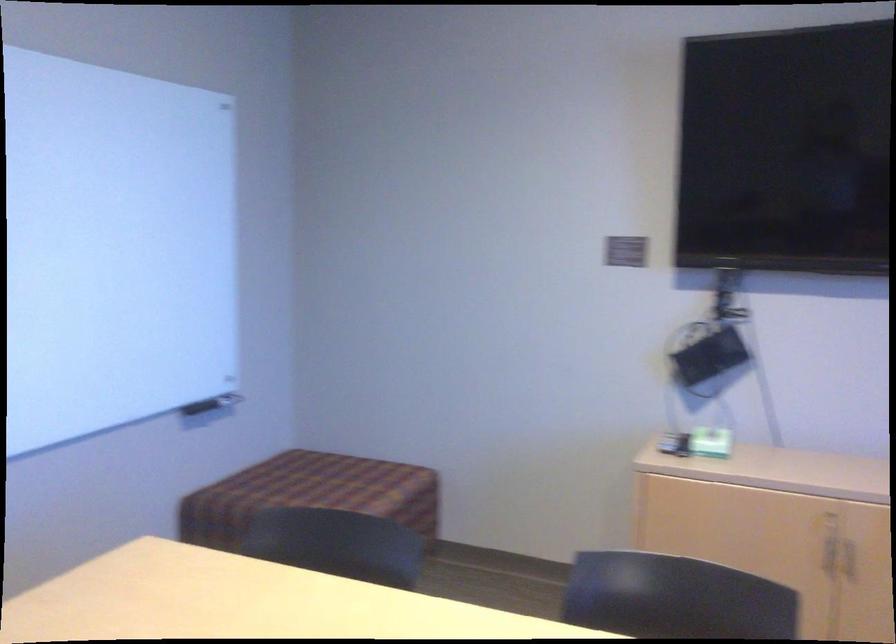
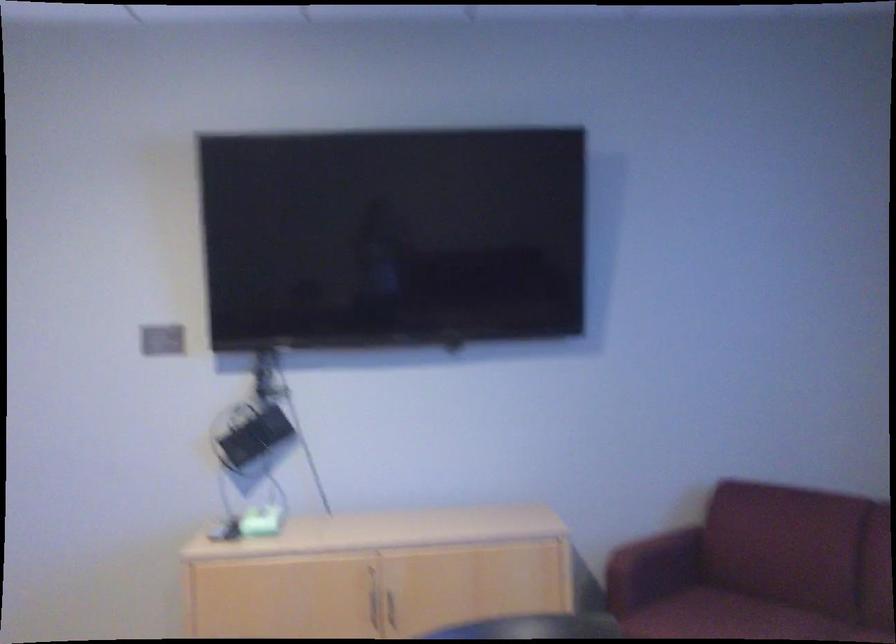
Where in the second image is the point corresponding to (707,442) from the first image?

(257, 522)